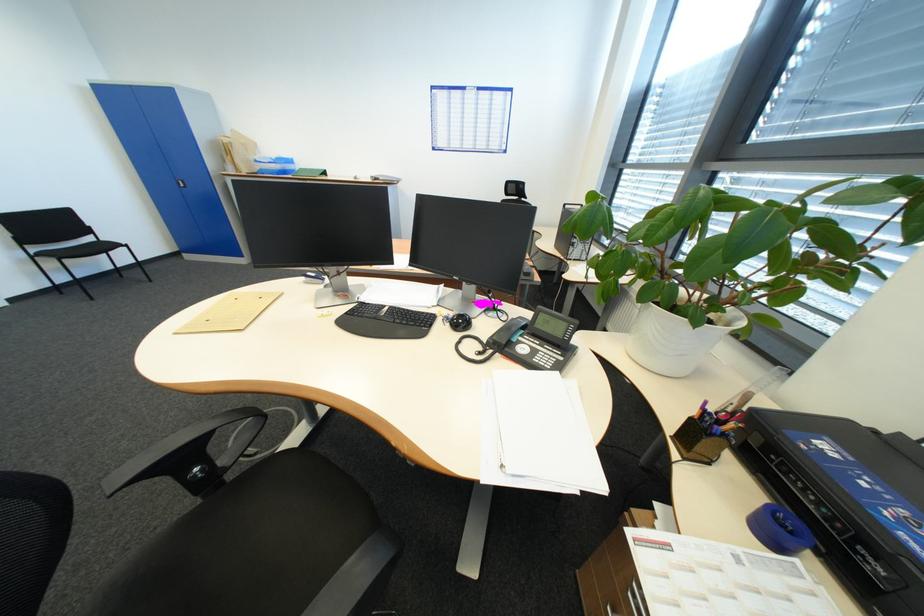
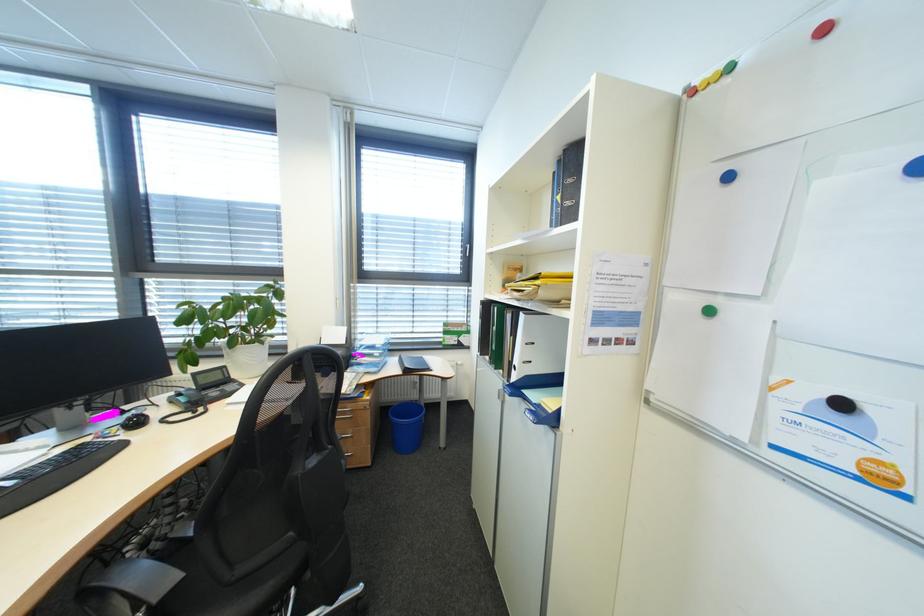
Find the pixel in the second image that matches the point at 505,310 in the first image.

(134, 413)